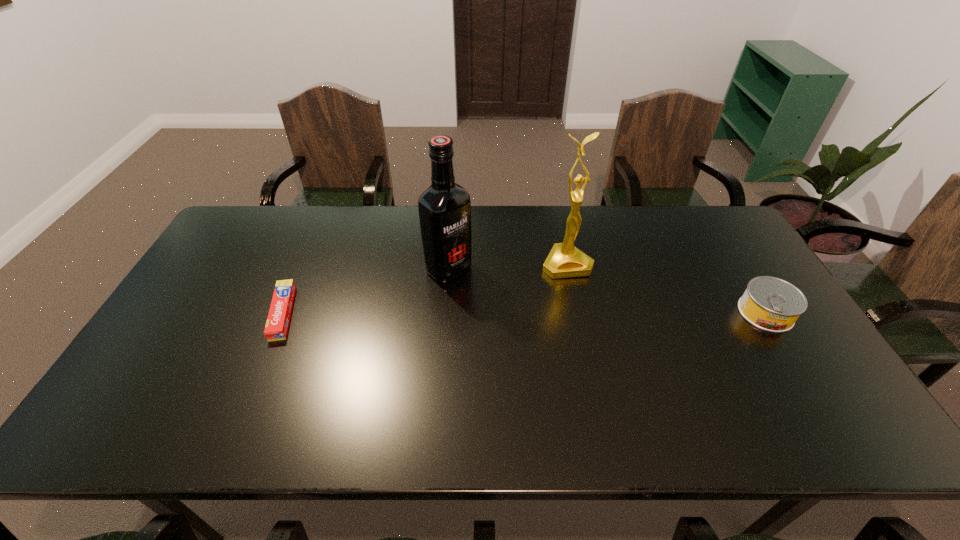
What are the coordinates of `vacant space on the desktop that is between the leftmost object and the can and is positioned on the front-facing side of the liquor` in the screenshot? It's located at (502, 313).

This screenshot has width=960, height=540. I want to click on vacant spot on the desktop that is between the shortest object and the can and is positioned on the front-facing side of the award, so click(590, 313).